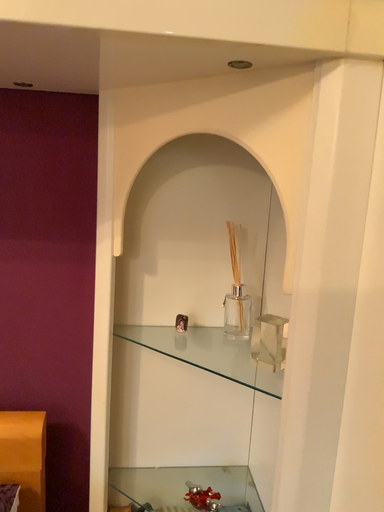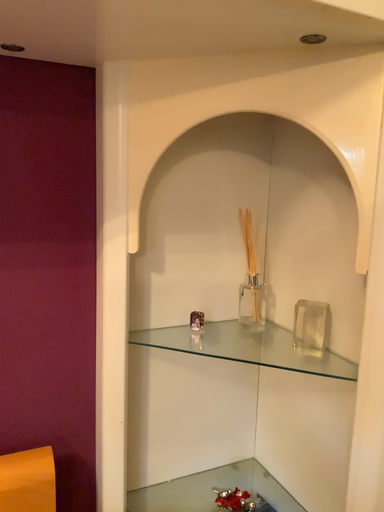
Question: Which way did the camera rotate in the video?

Choices:
 (A) rotated right
 (B) rotated left

Answer: (A)